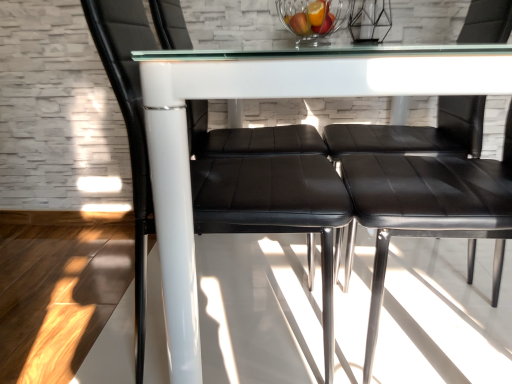
Locate an element on the screen. vacant area that lies between transparent glass table at center and black leather chair at center, positioned as the second chair in left-to-right order is located at coordinates (435, 268).